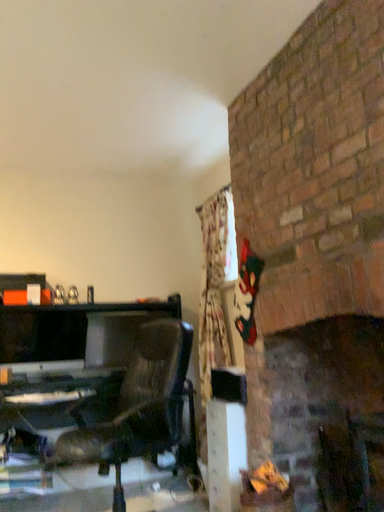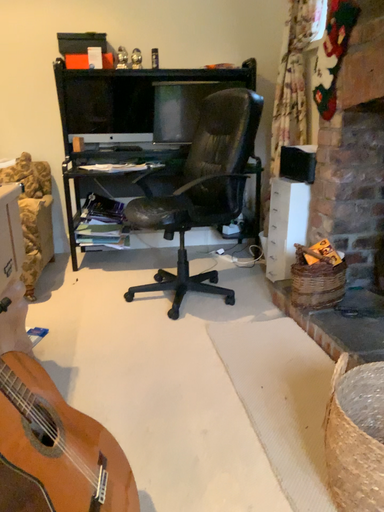
Question: Which way did the camera rotate in the video?

Choices:
 (A) rotated downward
 (B) rotated upward

Answer: (A)